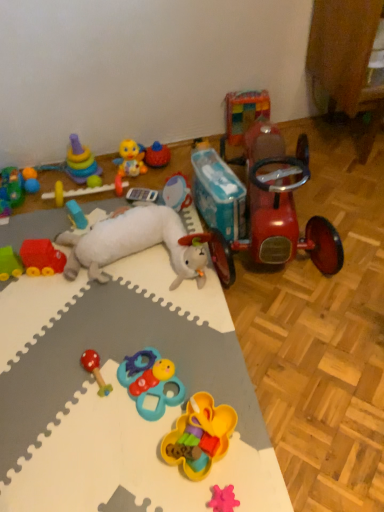
Find the location of a particular element. This screenshot has width=384, height=512. empty space that is in between pink rubber bear at lower center, which is the 11th toy in left-to-right order, and matte blue car at center-left, arranged as the 3th toy when viewed from the left is located at coordinates (152, 359).